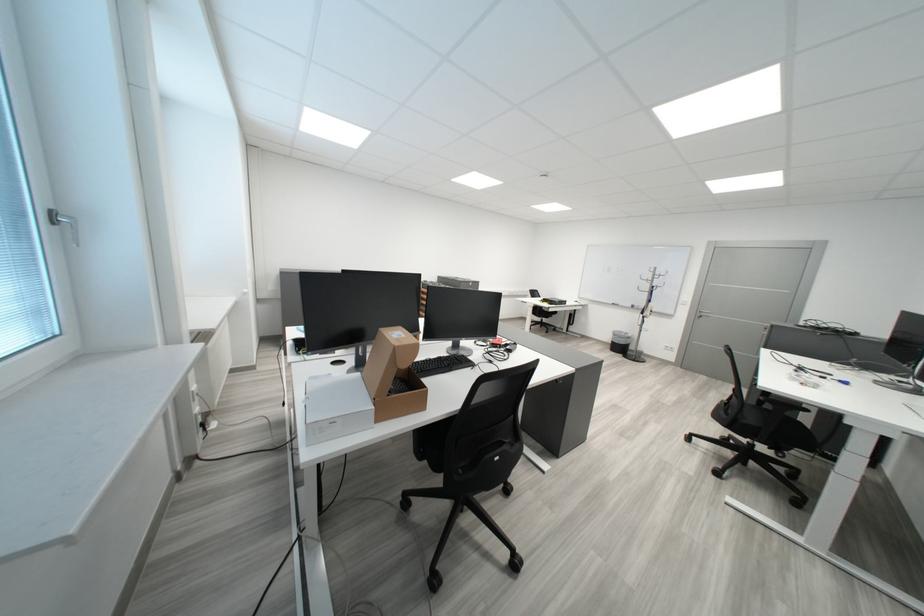
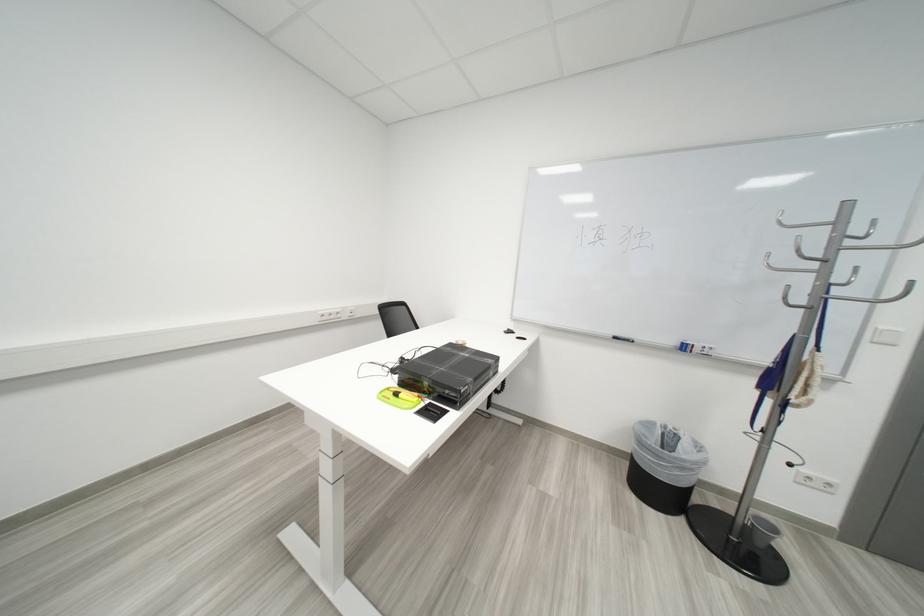
Locate, in the second image, the point that corresponds to (647,309) in the first image.

(698, 350)